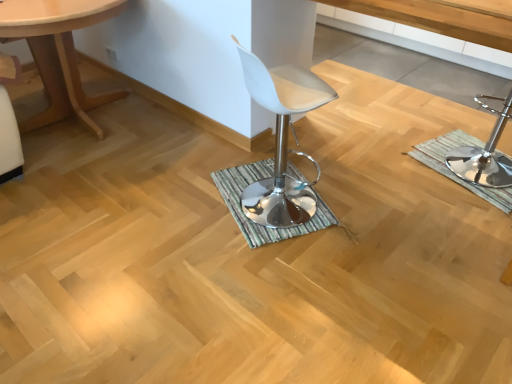
This screenshot has height=384, width=512. I want to click on vacant space that is to the left of white plastic stool at center, so click(x=186, y=215).